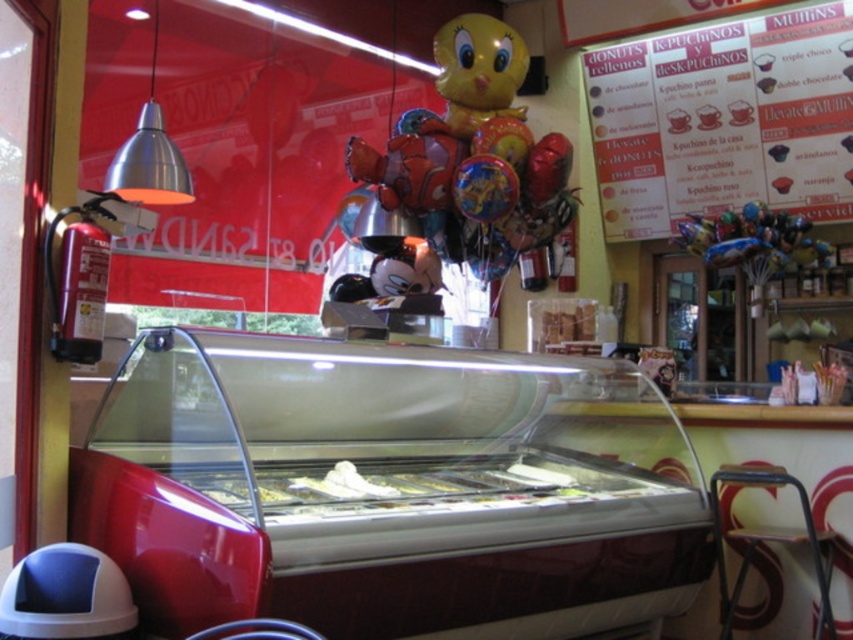
Question: Which is nearer to the red paper poster at upper right?

Choices:
 (A) metallic silver stool at lower right
 (B) yellow metallic balloon at center

Answer: (B)

Question: Does red paper poster at upper right appear over metallic silver stool at lower right?

Choices:
 (A) no
 (B) yes

Answer: (B)

Question: Is yellow metallic balloon at center bigger than metallic silver stool at lower right?

Choices:
 (A) yes
 (B) no

Answer: (A)

Question: Among these objects, which one is farthest from the camera?

Choices:
 (A) red paper poster at upper right
 (B) yellow metallic balloon at center
 (C) metallic silver stool at lower right

Answer: (A)

Question: Is red paper poster at upper right wider than metallic silver stool at lower right?

Choices:
 (A) yes
 (B) no

Answer: (A)

Question: Which point appears closest to the camera in this image?

Choices:
 (A) (676, 157)
 (B) (718, 474)

Answer: (B)